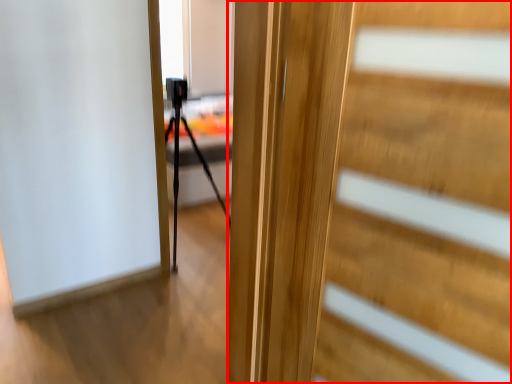
Question: From the image's perspective, what is the correct spatial positioning of door (annotated by the red box) in reference to tripod?

Choices:
 (A) above
 (B) below

Answer: (B)